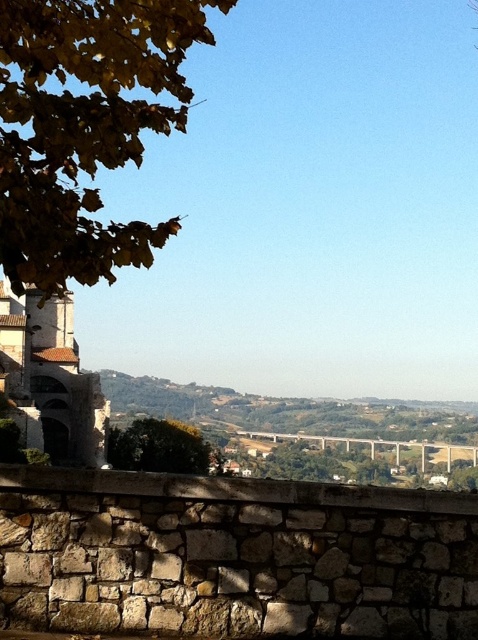
Question: Which object is farther from the camera taking this photo?

Choices:
 (A) green leafy tree at center
 (B) yellow leafy branch at upper left

Answer: (A)

Question: Where is yellow leafy branch at upper left located in relation to green leafy tree at center in the image?

Choices:
 (A) below
 (B) above

Answer: (B)

Question: Is yellow leafy branch at upper left above green leafy tree at center?

Choices:
 (A) no
 (B) yes

Answer: (B)

Question: From the image, what is the correct spatial relationship of yellow leafy branch at upper left in relation to green leafy tree at center?

Choices:
 (A) below
 (B) above

Answer: (B)